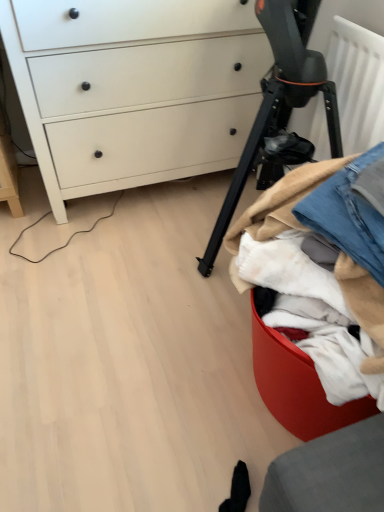
This screenshot has width=384, height=512. Find the location of `vacant space in front of black matte tripod at center`. vacant space in front of black matte tripod at center is located at coordinates (181, 358).